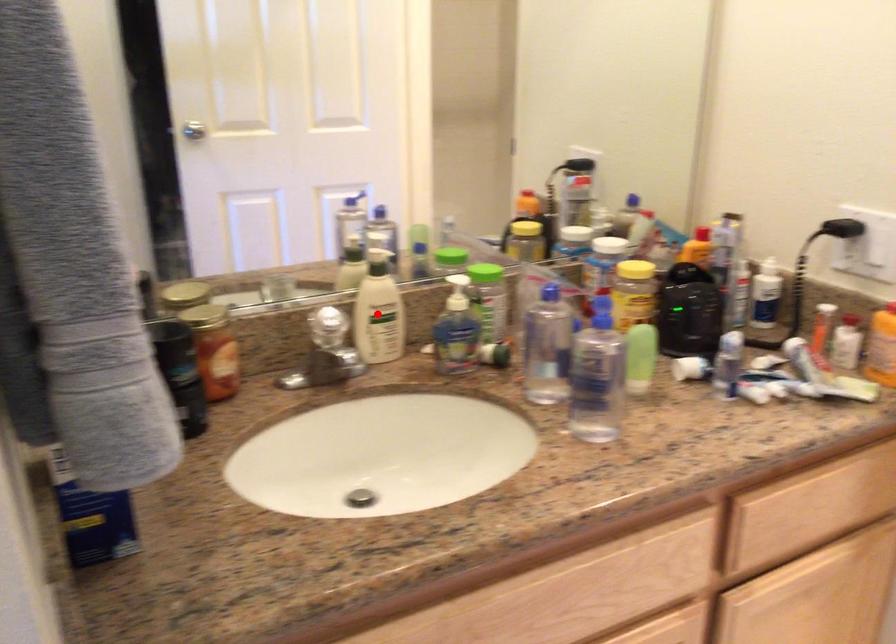
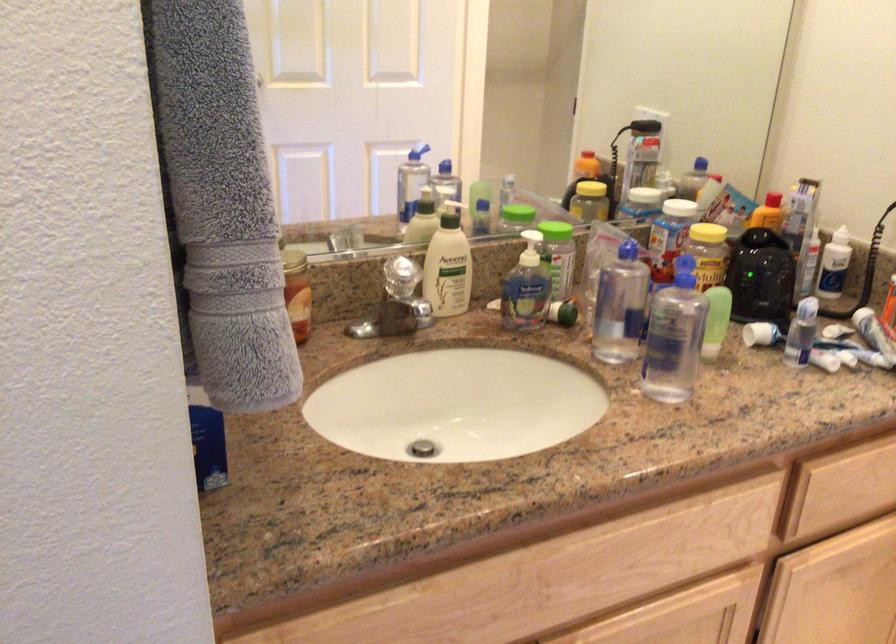
Locate, in the second image, the point that corresponds to the highlighted location in the first image.

(448, 265)